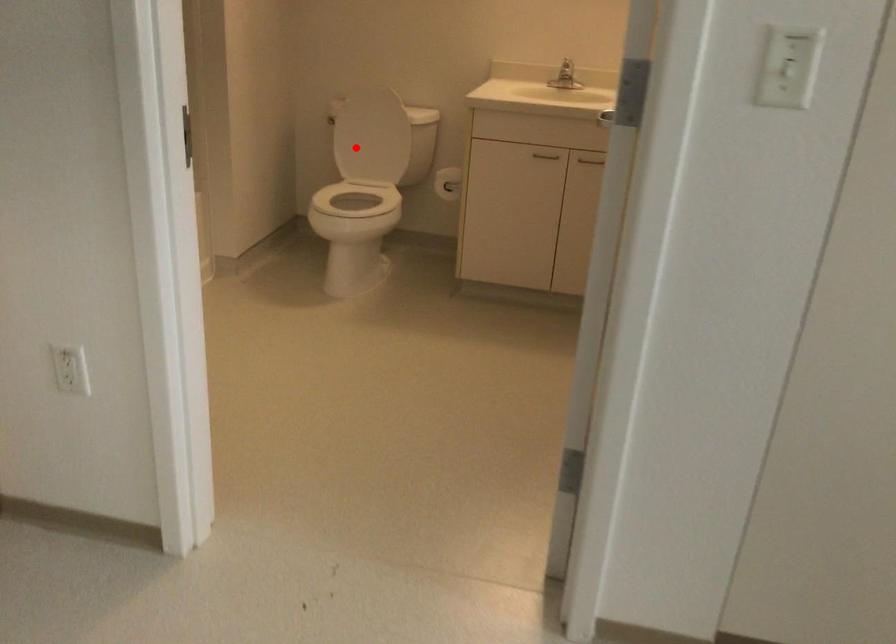
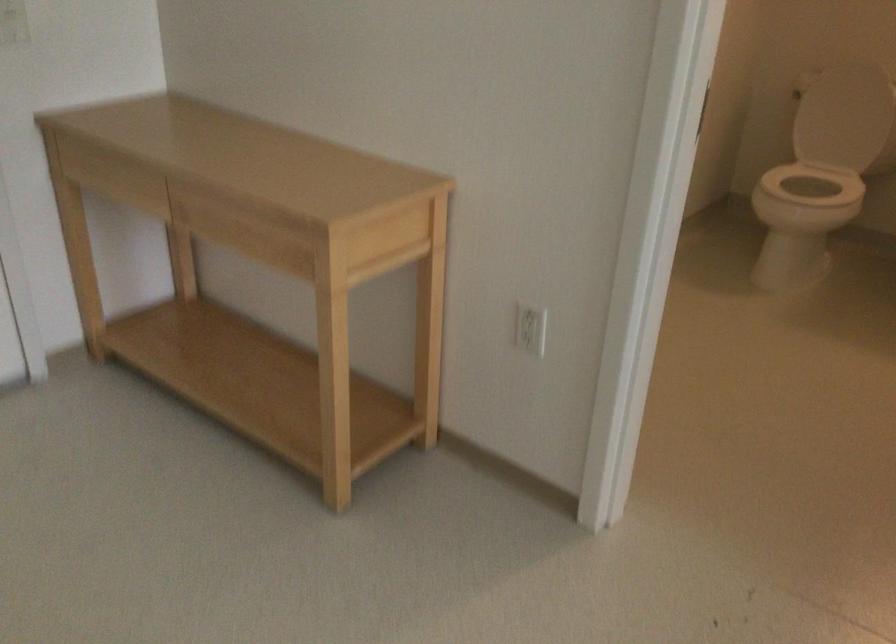
Question: A red point is marked in image1. In image2, is the corresponding 3D point closer to the camera or farther? Reply with the corresponding letter.

Choices:
 (A) The corresponding 3D point is closer.
 (B) The corresponding 3D point is farther.

Answer: (A)